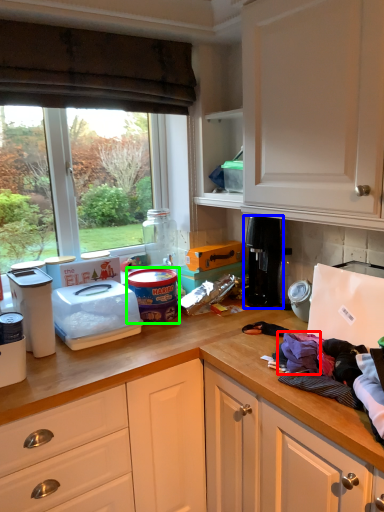
Question: Based on their relative distances, which object is nearer to clothing (highlighted by a red box)? Choose from coffee machine (highlighted by a blue box) and appliance (highlighted by a green box).

Choices:
 (A) coffee machine
 (B) appliance

Answer: (A)